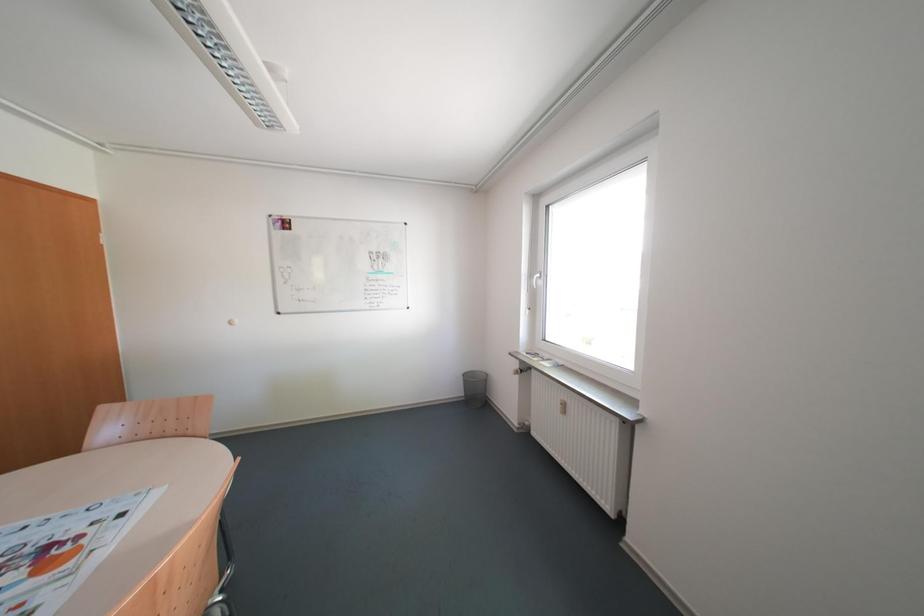
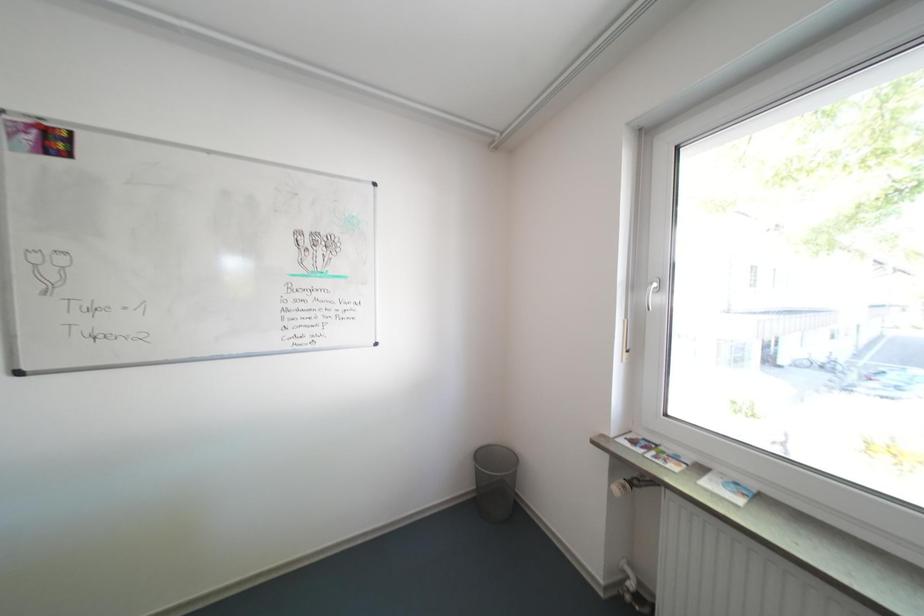
Question: Which direction would the cameraman need to move to produce the second image? Reply with the corresponding letter.

Choices:
 (A) Left
 (B) Right
 (C) Forward
 (D) Backward

Answer: (C)